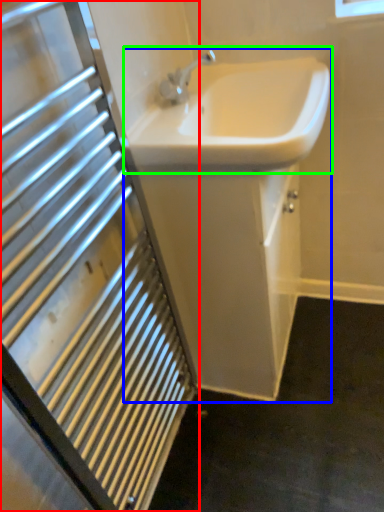
Question: Considering the real-world distances, which object is closest to bathroom cabinet (highlighted by a red box)? sink (highlighted by a blue box) or sink (highlighted by a green box).

Choices:
 (A) sink
 (B) sink

Answer: (A)